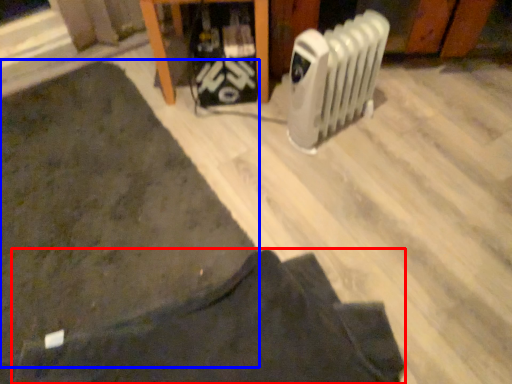
Question: Which point is closer to the camera, clothing (highlighted by a red box) or mat (highlighted by a blue box)?

Choices:
 (A) clothing
 (B) mat

Answer: (A)